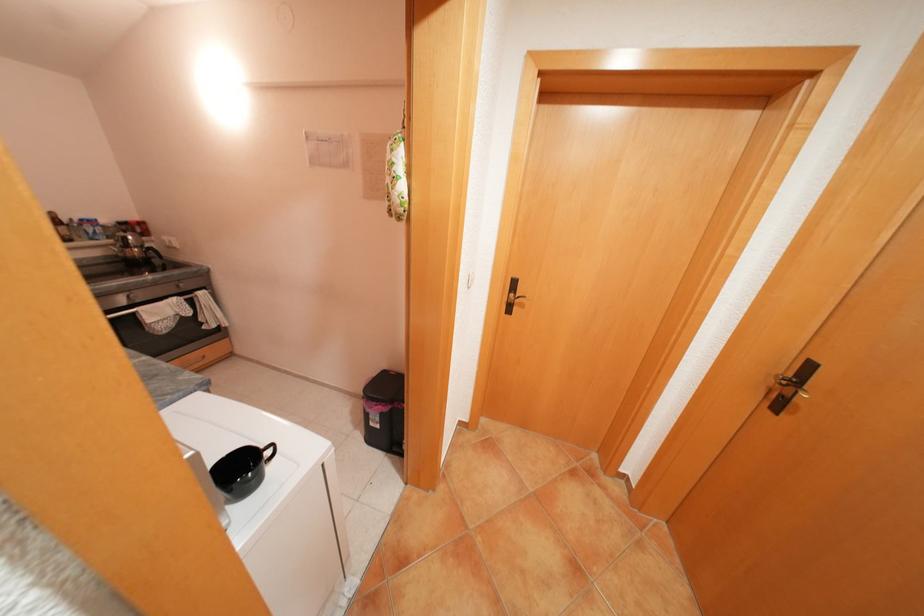
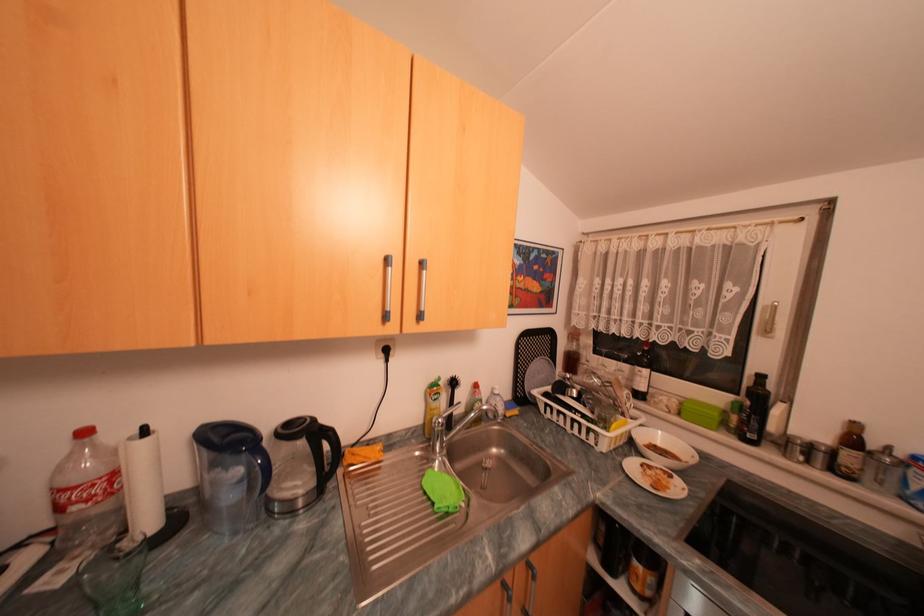
Locate, in the second image, the point that corresponds to point 67,222 in the first image.

(862, 440)